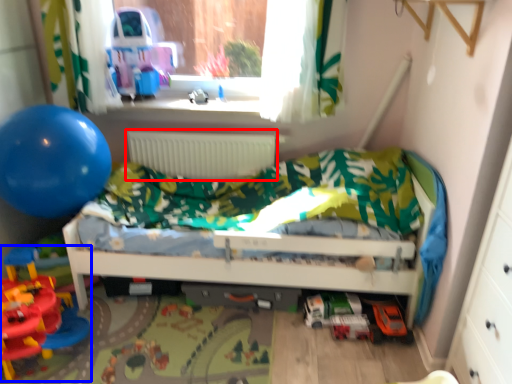
Question: Which object appears closest to the camera in this image, radiator (highlighted by a red box) or toy (highlighted by a blue box)?

Choices:
 (A) radiator
 (B) toy

Answer: (B)